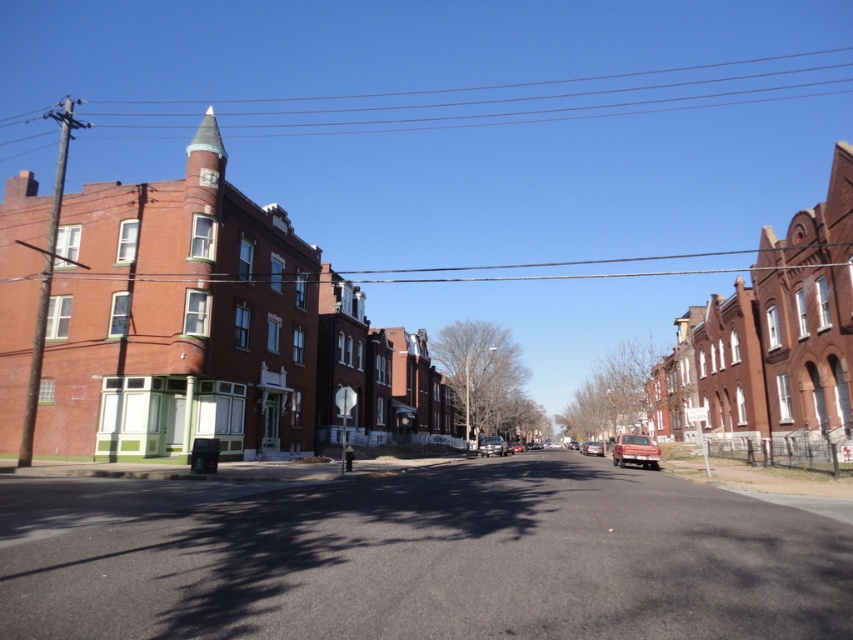
Based on the photo, can you confirm if matte red car at center is bigger than shiny silver sedan at center?

No.

Is point (646, 440) in front of point (494, 444)?

Yes, point (646, 440) is closer to viewer.

Is point (625, 460) positioned after point (480, 442)?

That is False.

Where is `matte red car at center`? Image resolution: width=853 pixels, height=640 pixels. matte red car at center is located at coordinates (635, 451).

Based on the photo, is matte red car at center taller than metallic silver car at center?

No.

Does matte red car at center lie behind metallic silver car at center?

No, it is in front of metallic silver car at center.

The height and width of the screenshot is (640, 853). Find the location of `matte red car at center`. matte red car at center is located at coordinates pos(635,451).

Which is more to the right, shiny silver sedan at center or metallic silver car at center?

metallic silver car at center

Can you confirm if shiny silver sedan at center is taller than metallic silver car at center?

Incorrect, shiny silver sedan at center's height is not larger of metallic silver car at center's.

Is point (490, 448) farther from camera compared to point (595, 451)?

Yes, point (490, 448) is behind point (595, 451).

Where is `shiny silver sedan at center`? The image size is (853, 640). shiny silver sedan at center is located at coordinates (492, 445).